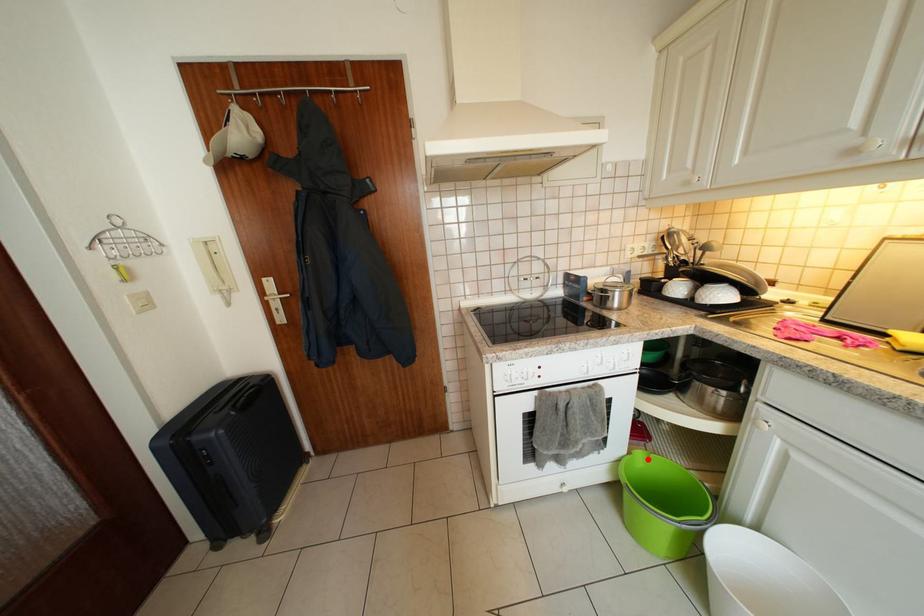
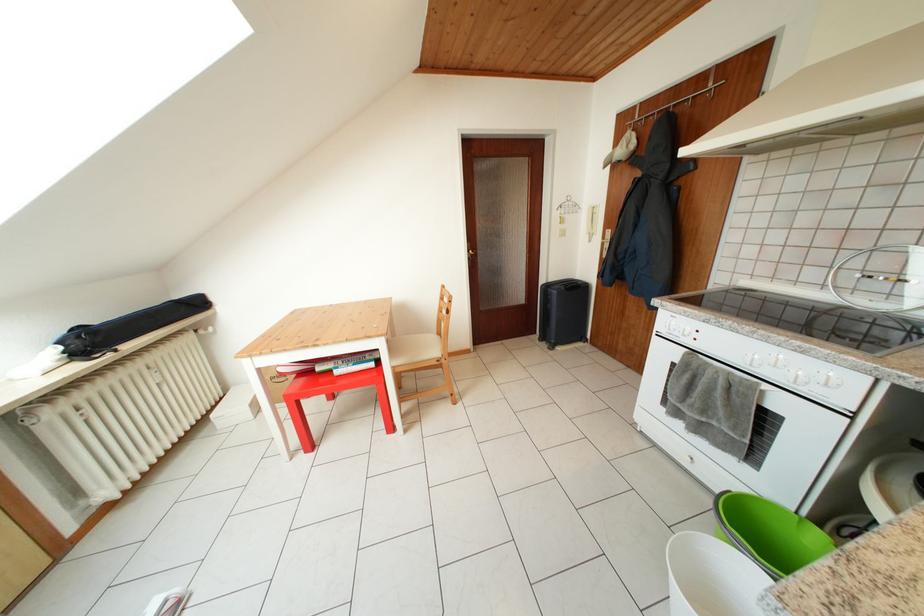
Locate, in the second image, the point that corresponds to the highlighted location in the first image.

(828, 540)